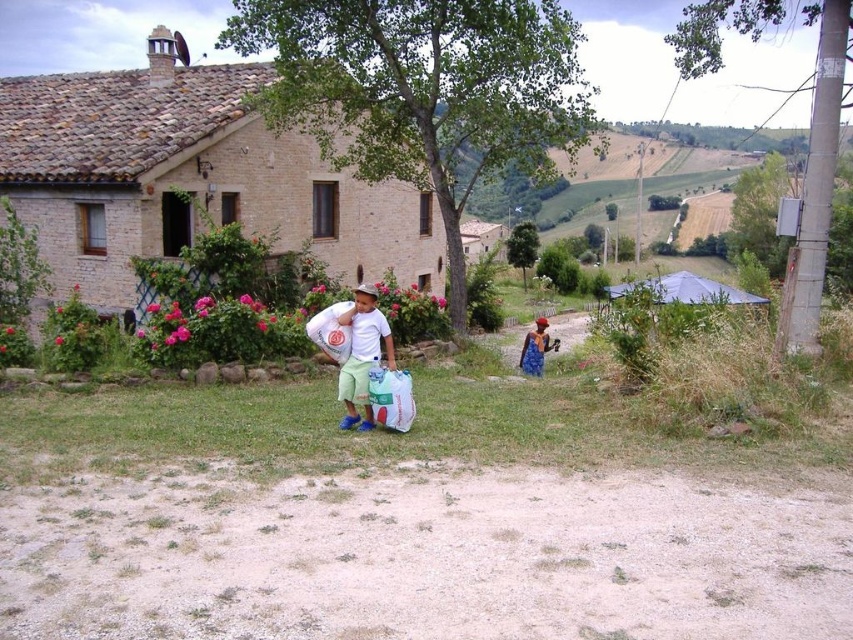
Who is more distant from viewer, (378,337) or (540,362)?

The point (540,362) is behind.

Does white matte shirt at center have a greater width compared to blue denim dress at lower right?

No.

At what (x,y) coordinates should I click in order to perform the action: click on white matte shirt at center. Please return your answer as a coordinate pair (x, y). This screenshot has width=853, height=640. Looking at the image, I should click on (363, 355).